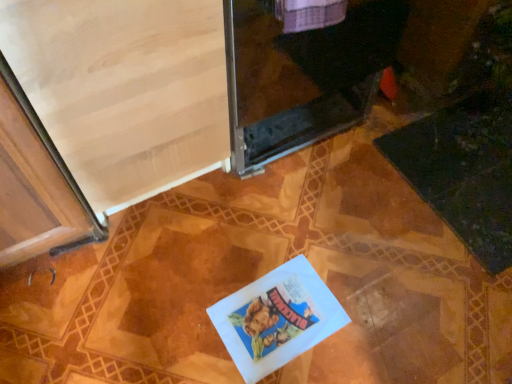
Question: Considering their positions, is white paper book at center located in front of or behind transparent glass screen door at upper center, positioned as the second screen door in left-to-right order?

Choices:
 (A) front
 (B) behind

Answer: (B)

Question: Is white paper book at center taller or shorter than transparent glass screen door at upper center, the first screen door when ordered from right to left?

Choices:
 (A) short
 (B) tall

Answer: (A)

Question: Which of these objects is positioned closest to the transparent glass screen door at upper center, positioned as the second screen door in left-to-right order?

Choices:
 (A) white paper book at center
 (B) light wood screen door at upper left, the first screen door positioned from the left

Answer: (B)

Question: Considering the real-world distances, which object is farthest from the light wood screen door at upper left, which appears as the second screen door when viewed from the right?

Choices:
 (A) white paper book at center
 (B) transparent glass screen door at upper center, the first screen door when ordered from right to left

Answer: (A)